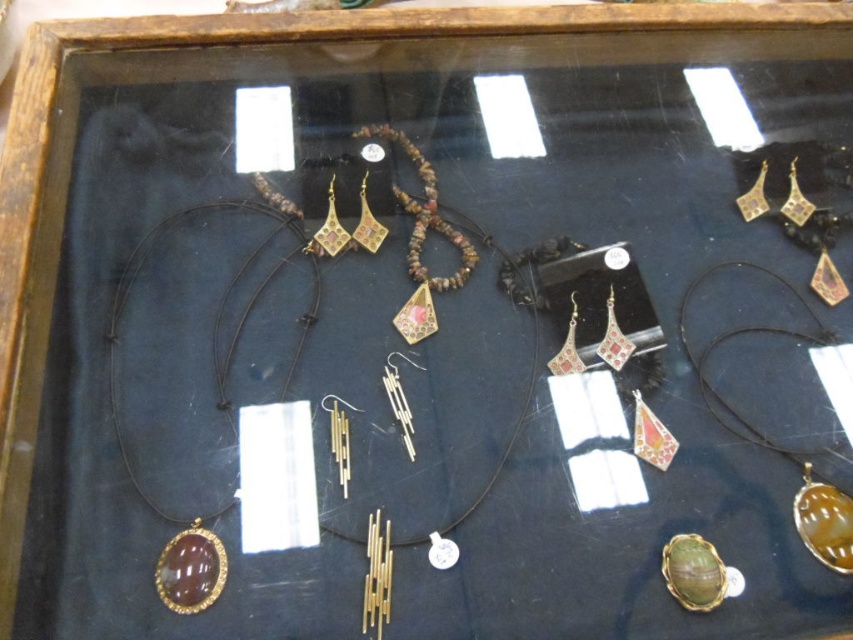
You are a customer in a jewelry store looking at the glass case. You want to know the exact position of the green stone pendant at lower right. What are its coordinates?

The green stone pendant at lower right is located at the coordinates point (778,388).